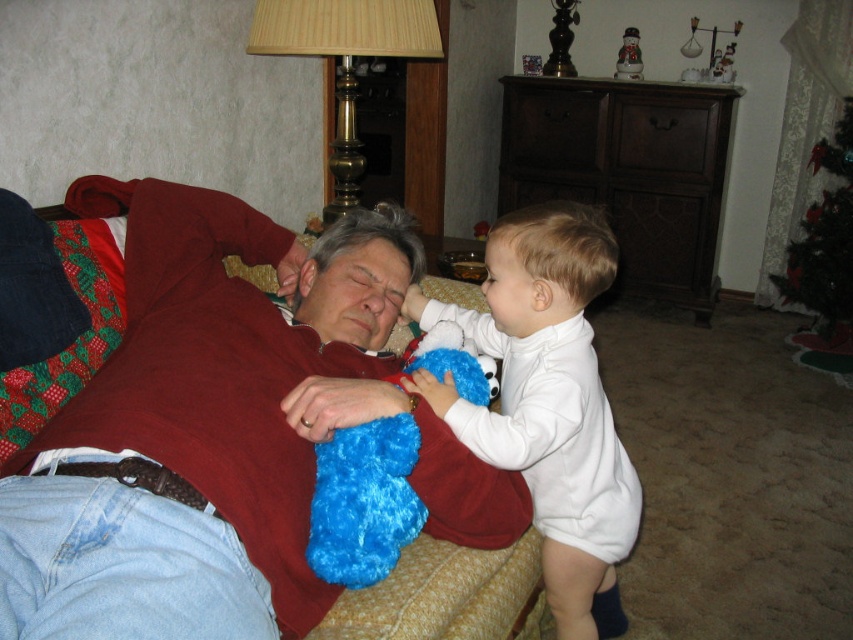
Does white soft onesie at center have a larger size compared to green shiny christmas tree at upper right?

Correct, white soft onesie at center is larger in size than green shiny christmas tree at upper right.

Between white soft onesie at center and green shiny christmas tree at upper right, which one is positioned higher?

green shiny christmas tree at upper right

Find the location of a particular element. This screenshot has width=853, height=640. white soft onesie at center is located at coordinates (549, 403).

What are the coordinates of `white soft onesie at center` in the screenshot? It's located at (549, 403).

Consider the image. Between fuzzy blue stuffed toy at upper center and gold brass lamp at upper center, which one appears on the left side from the viewer's perspective?

gold brass lamp at upper center

This screenshot has width=853, height=640. Describe the element at coordinates (222, 429) in the screenshot. I see `fuzzy blue stuffed toy at upper center` at that location.

Between point (210, 195) and point (339, 8), which one is positioned behind?

Positioned behind is point (339, 8).

Locate an element on the screen. The width and height of the screenshot is (853, 640). fuzzy blue stuffed toy at upper center is located at coordinates (222, 429).

Can you confirm if white soft onesie at center is positioned to the right of gold brass lamp at upper center?

Correct, you'll find white soft onesie at center to the right of gold brass lamp at upper center.

Which of these two, white soft onesie at center or gold brass lamp at upper center, stands shorter?

gold brass lamp at upper center

Which is in front, point (569, 624) or point (422, 136)?

Point (569, 624)

What are the coordinates of `white soft onesie at center` in the screenshot? It's located at (549, 403).